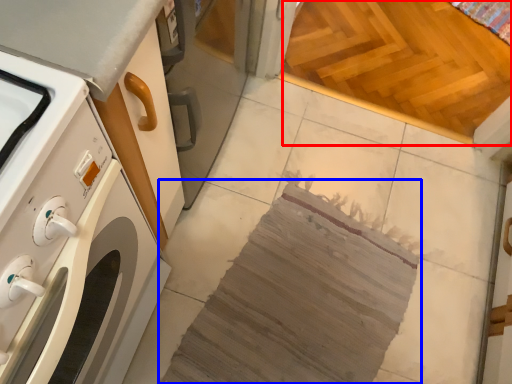
Question: Which point is closer to the camera, plywood (highlighted by a red box) or blanket (highlighted by a blue box)?

Choices:
 (A) plywood
 (B) blanket

Answer: (B)